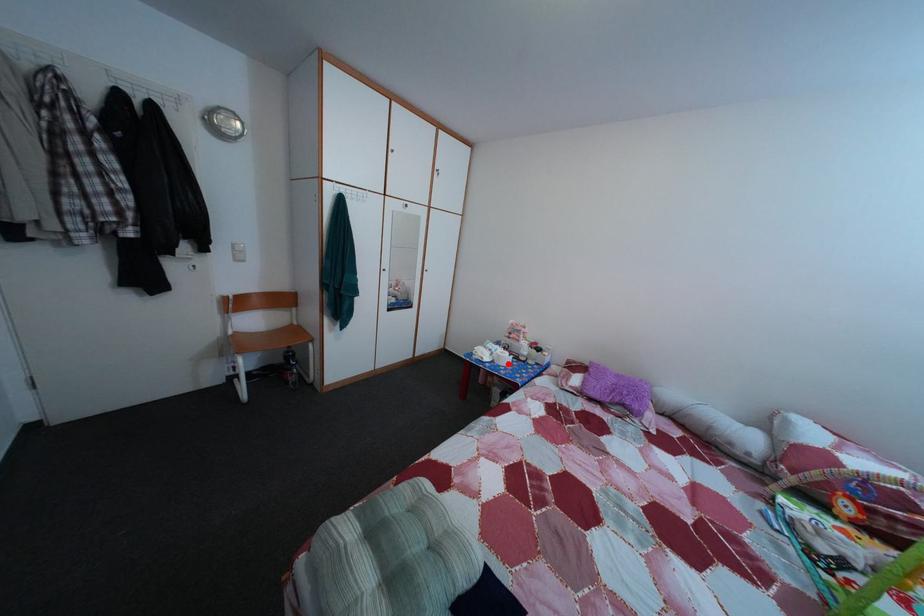
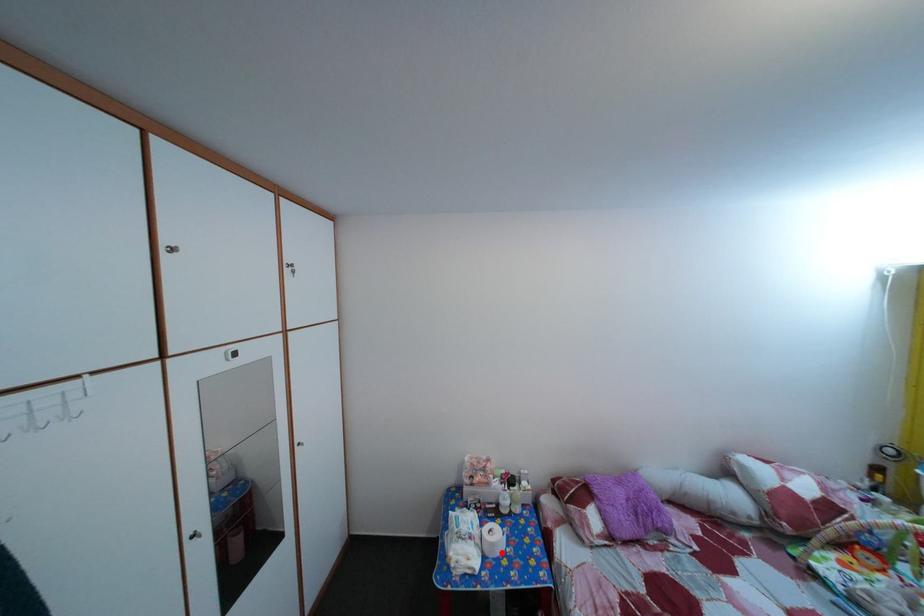
I am providing you with two images of the same scene from different viewpoints. A red point is marked on the first image and another point is marked on the second image. Does the point marked in image1 correspond to the same location as the one in image2?

Yes